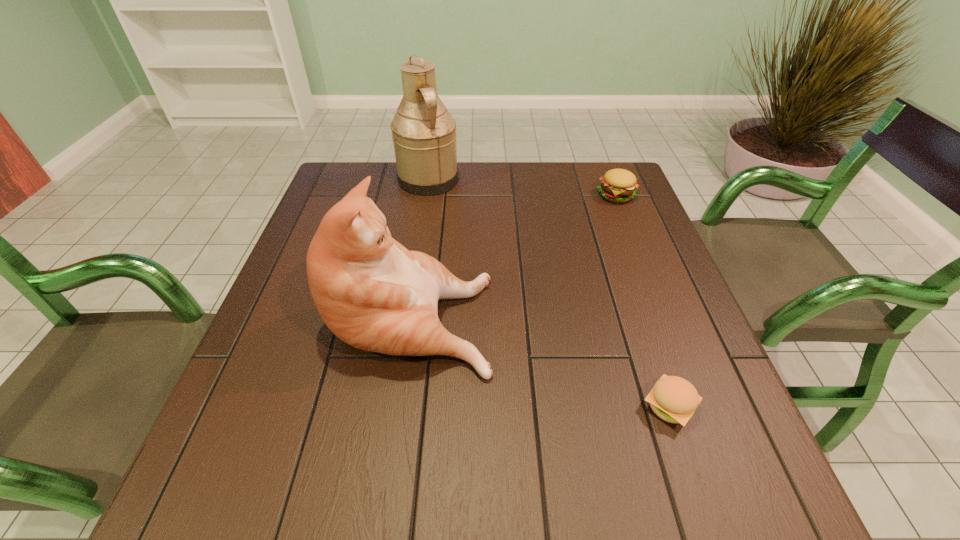
Locate an element on the screen. hamburger located in the far edge section of the desktop is located at coordinates (617, 185).

Where is `object located at the left edge`? object located at the left edge is located at coordinates (374, 294).

The width and height of the screenshot is (960, 540). In order to click on object that is at the far right corner in this screenshot , I will do `click(617, 185)`.

In the image, there is a desktop. Where is `vacant space at the far edge`? vacant space at the far edge is located at coordinates (397, 186).

In the image, there is a desktop. Find the location of `free space at the near edge`. free space at the near edge is located at coordinates (305, 516).

The width and height of the screenshot is (960, 540). Find the location of `vacant position at the left edge of the desktop`. vacant position at the left edge of the desktop is located at coordinates (320, 220).

Identify the location of free region at the right edge of the desktop. (610, 246).

Image resolution: width=960 pixels, height=540 pixels. Identify the location of vacant space at the far left corner of the desktop. (380, 168).

The width and height of the screenshot is (960, 540). I want to click on vacant space at the near right corner, so click(x=745, y=493).

I want to click on free space between the nearer hamburger and the pitcher, so click(x=549, y=293).